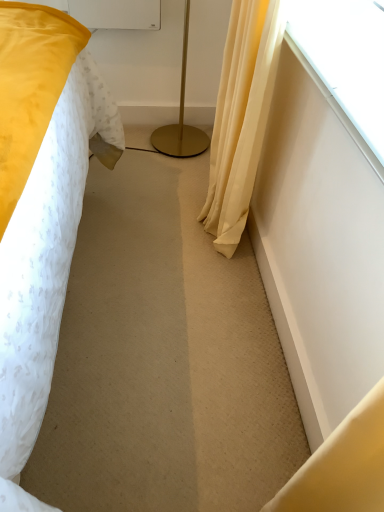
Locate an element on the screen. Image resolution: width=384 pixels, height=512 pixels. vacant space to the left of silky yellow curtain at right is located at coordinates (145, 224).